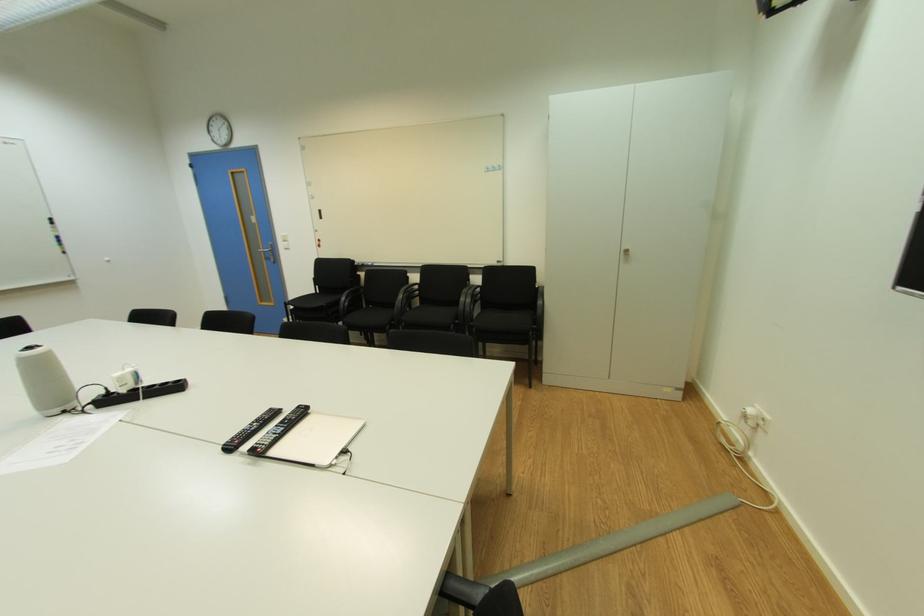
Locate an element on the screen. The width and height of the screenshot is (924, 616). metal cabinet handle is located at coordinates (625, 253).